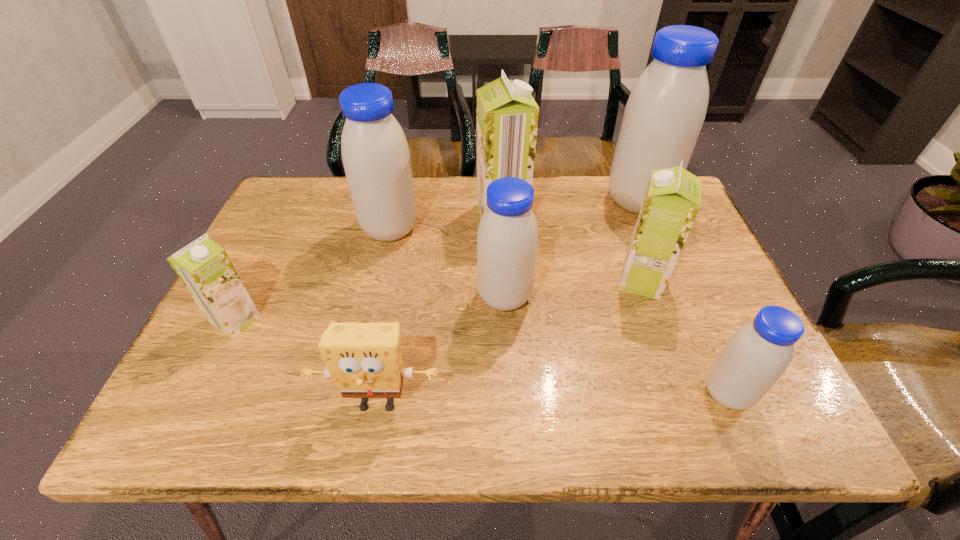
Find the location of a particular element. Image resolution: width=960 pixels, height=540 pixels. free spot located 0.370m on the right of the leftmost soya milk is located at coordinates (426, 320).

The width and height of the screenshot is (960, 540). I want to click on vacant space located on the left of the nearest blue soya milk, so click(x=593, y=393).

This screenshot has height=540, width=960. I want to click on soya milk located at the near edge, so click(758, 353).

Where is `sponge that is positioned at the near edge`? sponge that is positioned at the near edge is located at coordinates (364, 360).

You are a GUI agent. You are given a task and a screenshot of the screen. Output one action in this format:
    pyautogui.click(x=<x>, y=<y>)
    Task: Click on the object at the left edge
    The width and height of the screenshot is (960, 540).
    Given the screenshot: What is the action you would take?
    pyautogui.click(x=203, y=266)

In order to click on object at the far right corner in this screenshot , I will do `click(663, 117)`.

Where is `object that is at the near right corner`? The image size is (960, 540). object that is at the near right corner is located at coordinates point(758,353).

Image resolution: width=960 pixels, height=540 pixels. In the image, there is a desktop. Find the location of `free space at the far edge`. free space at the far edge is located at coordinates (462, 200).

Where is `free space at the near edge`? This screenshot has height=540, width=960. free space at the near edge is located at coordinates (466, 401).

At what (x,y) coordinates should I click in order to perform the action: click on vacant space at the left edge. Please return your answer as a coordinate pair (x, y). Looking at the image, I should click on (259, 234).